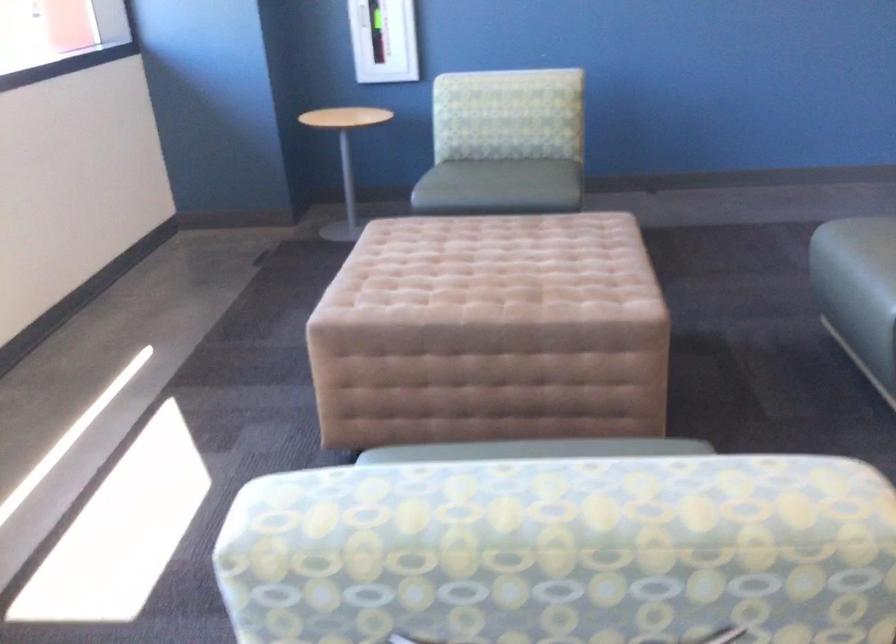
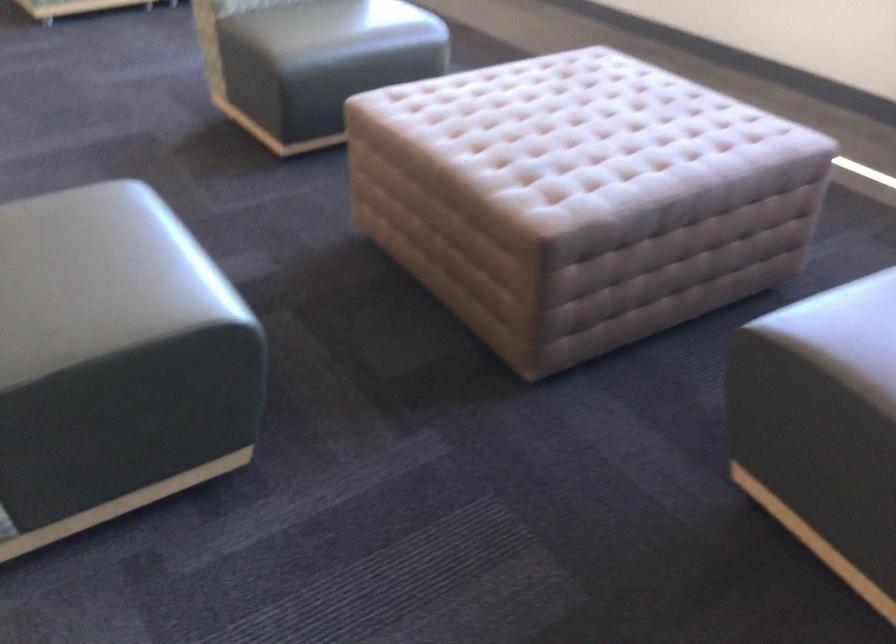
In the second image, find the point that corresponds to [590,449] in the first image.

(334, 26)